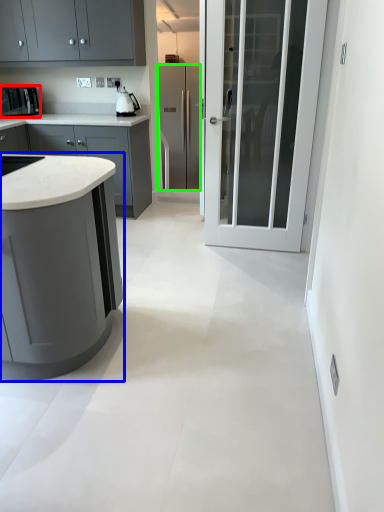
Question: Considering the real-world distances, which object is farthest from kitchen appliance (highlighted by a red box)? cabinetry (highlighted by a blue box) or refrigerator (highlighted by a green box)?

Choices:
 (A) cabinetry
 (B) refrigerator

Answer: (A)